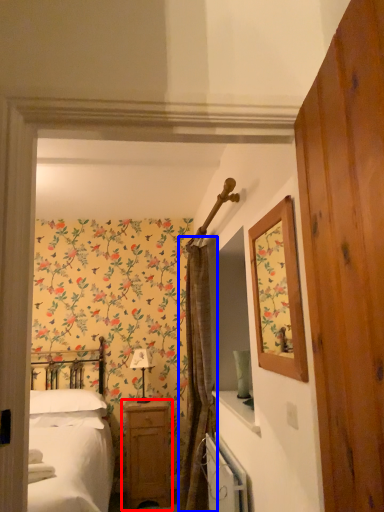
Question: Which point is closer to the camera, nightstand (highlighted by a red box) or curtain (highlighted by a blue box)?

Choices:
 (A) nightstand
 (B) curtain

Answer: (B)